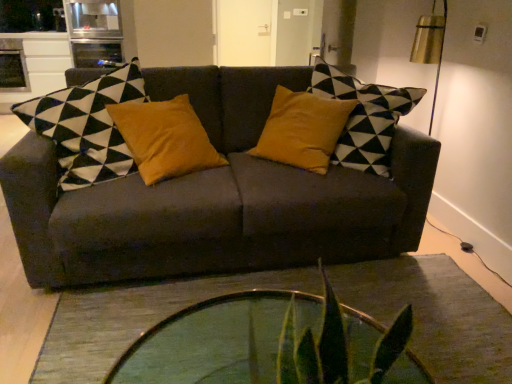
Question: Considering the relative sizes of transparent glass coffee table at center and dark gray fabric couch at center in the image provided, is transparent glass coffee table at center shorter than dark gray fabric couch at center?

Choices:
 (A) no
 (B) yes

Answer: (B)

Question: Is transparent glass coffee table at center with dark gray fabric couch at center?

Choices:
 (A) yes
 (B) no

Answer: (B)

Question: Would you say transparent glass coffee table at center is a long distance from dark gray fabric couch at center?

Choices:
 (A) no
 (B) yes

Answer: (A)

Question: From the image's perspective, is transparent glass coffee table at center on dark gray fabric couch at center?

Choices:
 (A) no
 (B) yes

Answer: (A)

Question: Is dark gray fabric couch at center surrounded by transparent glass coffee table at center?

Choices:
 (A) no
 (B) yes

Answer: (A)

Question: Is transparent glass coffee table at center behind dark gray fabric couch at center?

Choices:
 (A) no
 (B) yes

Answer: (A)

Question: Is dark gray fabric couch at center in front of transparent glass coffee table at center?

Choices:
 (A) yes
 (B) no

Answer: (B)

Question: Is dark gray fabric couch at center facing away from transparent glass coffee table at center?

Choices:
 (A) yes
 (B) no

Answer: (B)

Question: From the image's perspective, is dark gray fabric couch at center located above transparent glass coffee table at center?

Choices:
 (A) no
 (B) yes

Answer: (B)

Question: Is dark gray fabric couch at center located outside transparent glass coffee table at center?

Choices:
 (A) no
 (B) yes

Answer: (B)

Question: Can you confirm if dark gray fabric couch at center is positioned to the right of transparent glass coffee table at center?

Choices:
 (A) no
 (B) yes

Answer: (A)

Question: Is dark gray fabric couch at center far from transparent glass coffee table at center?

Choices:
 (A) yes
 (B) no

Answer: (B)

Question: From a real-world perspective, relative to transparent glass coffee table at center, is dark gray fabric couch at center vertically above or below?

Choices:
 (A) below
 (B) above

Answer: (B)